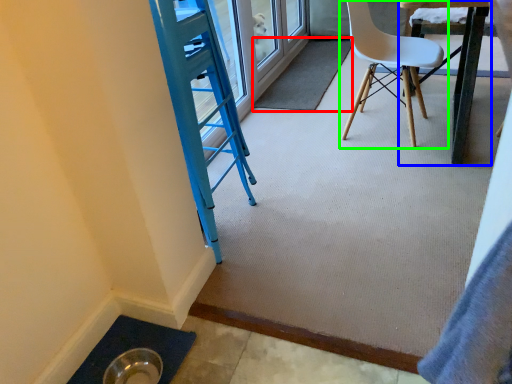
Question: Which object is positioned closest to mat (highlighted by a red box)? Select from table (highlighted by a blue box) and chair (highlighted by a green box).

Choices:
 (A) table
 (B) chair

Answer: (B)